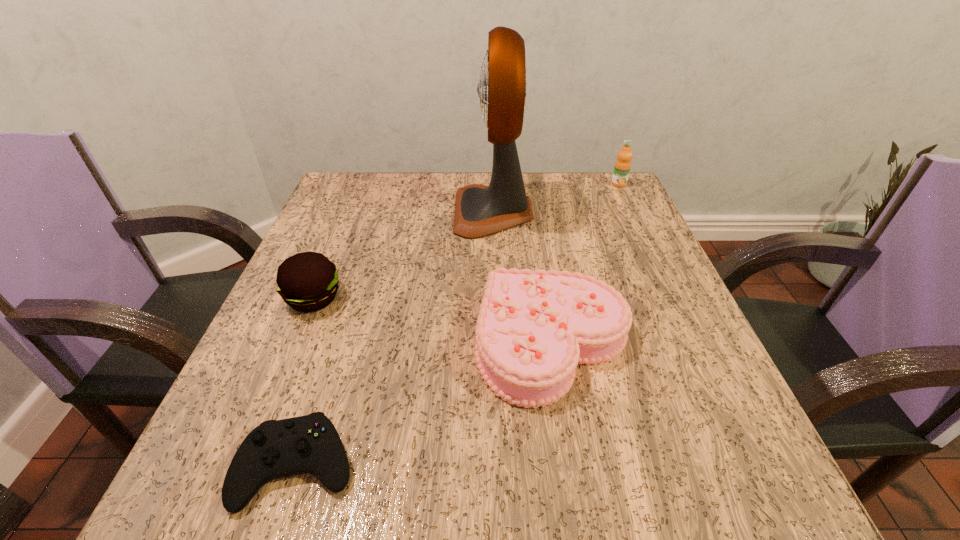
Identify the location of empty location between the rightmost object and the third shortest object. (467, 241).

Image resolution: width=960 pixels, height=540 pixels. What are the coordinates of `object that can be found as the closest to the third shortest object` in the screenshot? It's located at (275, 449).

Identify the location of object that is the closest one to the rightmost object. The image size is (960, 540). (480, 210).

Identify the location of free point that satisfies the following two spatial constraints: 1. on the front side of the cake; 2. on the left side of the patty. This screenshot has height=540, width=960. 295,343.